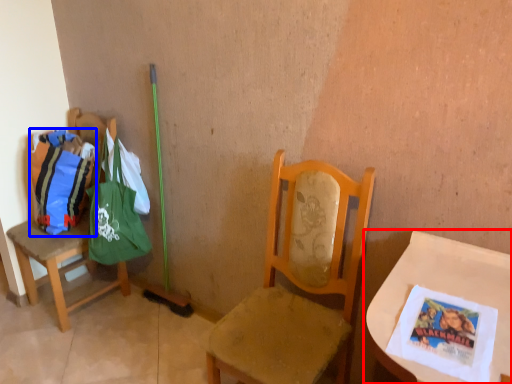
Question: Which of the following is the farthest to the observer, table (highlighted by a red box) or grocery bag (highlighted by a blue box)?

Choices:
 (A) table
 (B) grocery bag

Answer: (B)